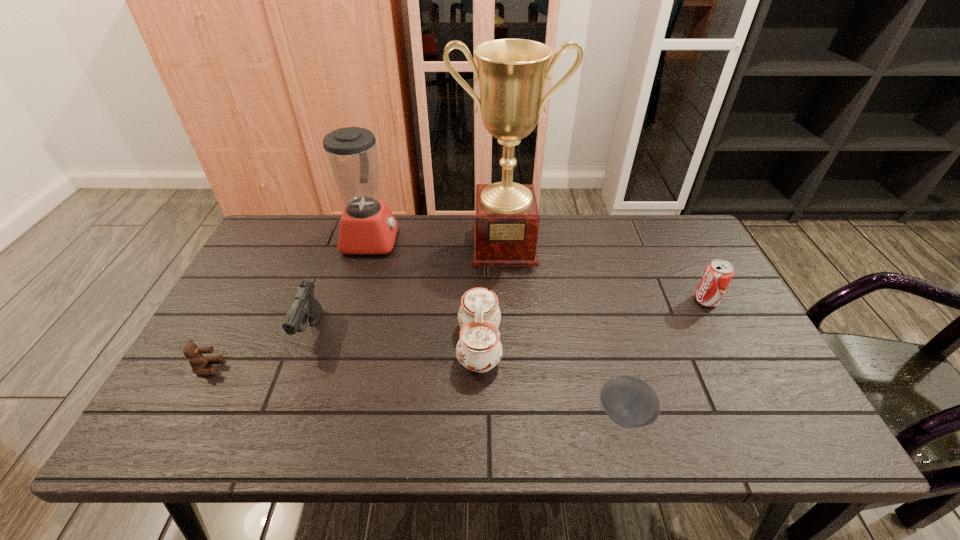
Image resolution: width=960 pixels, height=540 pixels. I want to click on free location located 0.400m on the front of the blender near the controls, so click(x=522, y=240).

Image resolution: width=960 pixels, height=540 pixels. I want to click on free space located 0.070m by the handle of the chinaware, so click(529, 346).

This screenshot has height=540, width=960. In order to click on vacant region located 0.070m on the front of the soda can in this screenshot , I will do 721,328.

The image size is (960, 540). Identify the location of free space located 0.110m at the barrel of the pistol. (287, 397).

The image size is (960, 540). What are the coordinates of `free space located 0.080m on the face of the sixth tallest object` in the screenshot? It's located at (252, 367).

The image size is (960, 540). I want to click on vacant space located 0.270m on the back of the shortest object, so click(595, 303).

You are a GUI agent. You are given a task and a screenshot of the screen. Output one action in this format:
    pyautogui.click(x=<x>, y=<y>)
    Task: Click on the trophy cup positioned at the far edge
    The height and width of the screenshot is (540, 960).
    Given the screenshot: What is the action you would take?
    pyautogui.click(x=512, y=72)

Where is `blender situated at the far edge`? blender situated at the far edge is located at coordinates (367, 226).

Locate an element on the screen. object present at the near edge is located at coordinates (630, 402).

Where is `object that is at the left edge`? object that is at the left edge is located at coordinates (197, 361).